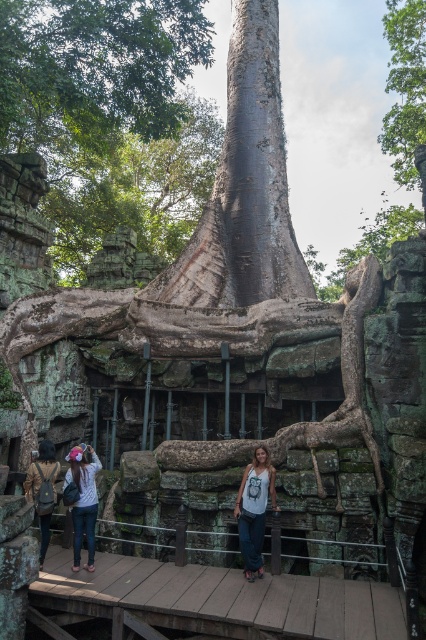
Question: Can you confirm if green mossy stone at center is smaller than denim jacket at lower left?

Choices:
 (A) no
 (B) yes

Answer: (A)

Question: Is denim pants at lower left to the left of denim jacket at lower left from the viewer's perspective?

Choices:
 (A) no
 (B) yes

Answer: (A)

Question: Which point is farther from the camera taking this photo?

Choices:
 (A) (147, 6)
 (B) (402, 84)
 (C) (48, 476)

Answer: (B)

Question: Which point is closer to the camera?

Choices:
 (A) (224, 449)
 (B) (48, 524)
 (C) (258, 499)
 (D) (408, 129)

Answer: (C)

Question: Which point appears closest to the camera in this image?

Choices:
 (A) (250, 515)
 (B) (49, 449)

Answer: (A)

Question: Can you confirm if green leafy tree at upper left is smaller than green rough bark tree at upper right?

Choices:
 (A) no
 (B) yes

Answer: (B)